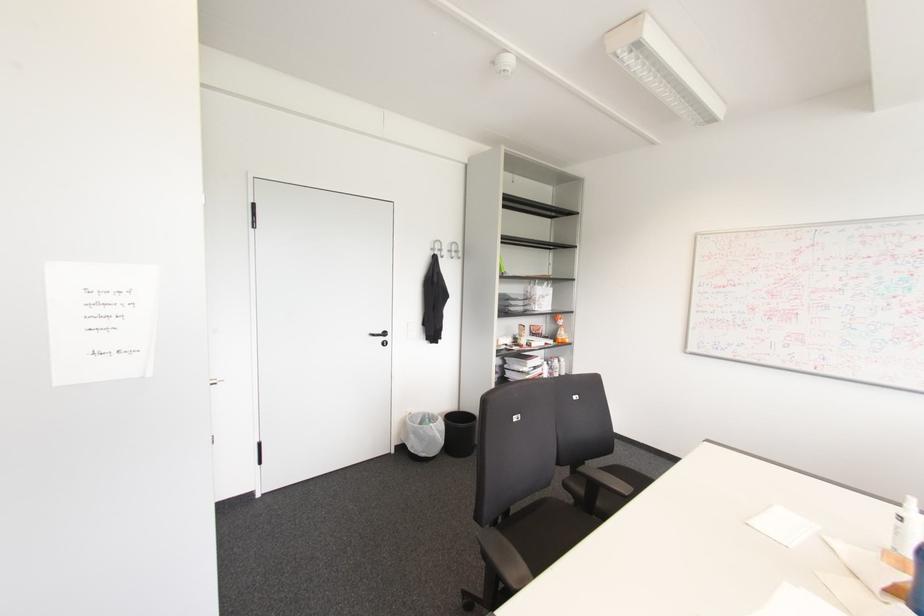
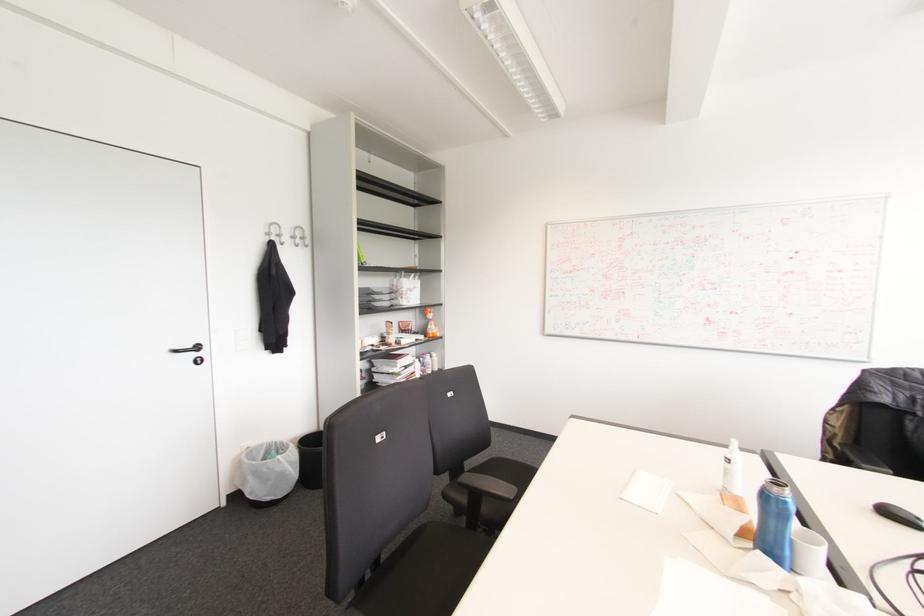
The point at (383,333) is marked in the first image. Where is the corresponding point in the second image?

(197, 347)